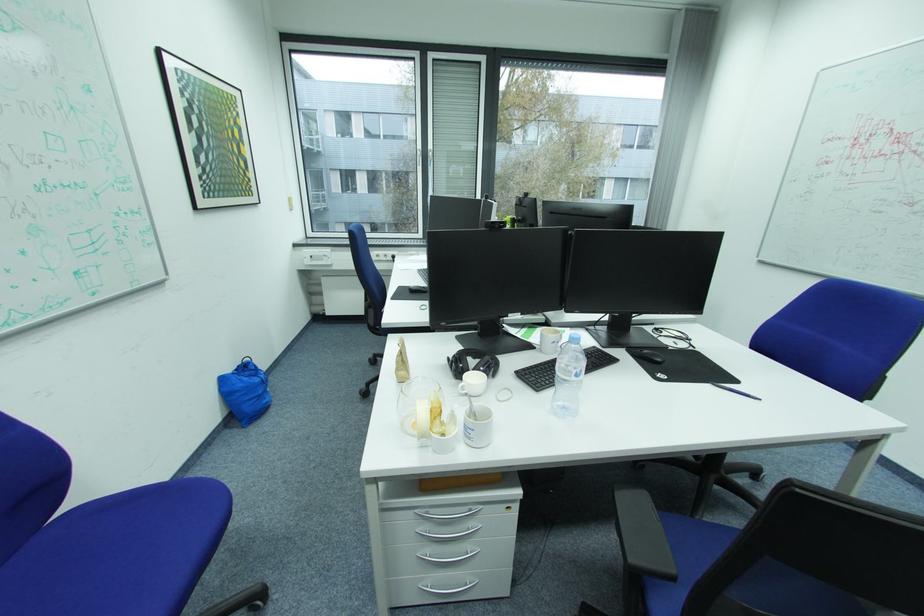
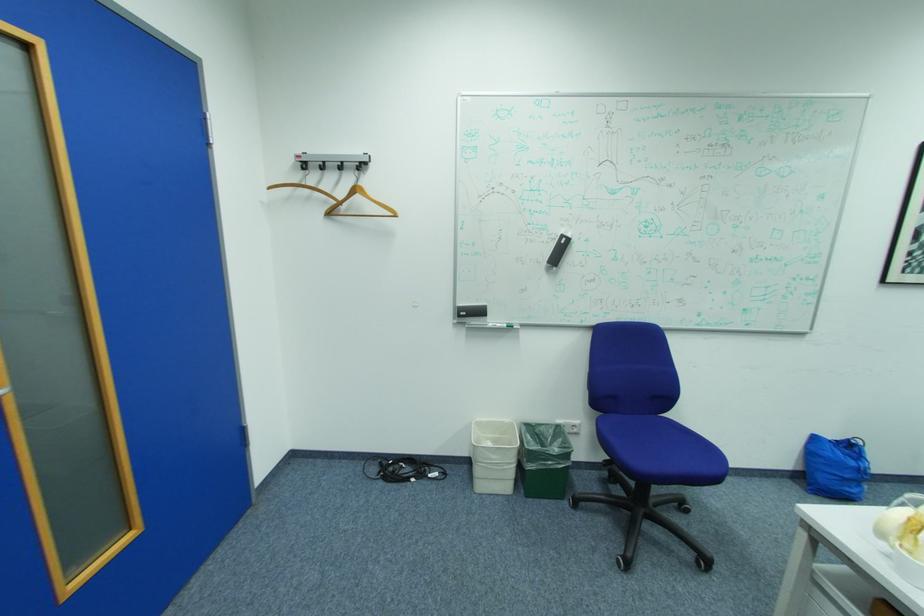
Question: Based on the continuous images, in which direction is the camera rotating? Reply with the corresponding letter.

Choices:
 (A) Left
 (B) Right
 (C) Up
 (D) Down

Answer: (A)